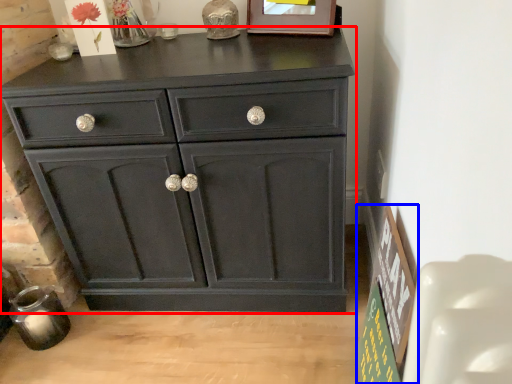
Question: Among these objects, which one is farthest to the camera, chest of drawers (highlighted by a red box) or bulletin board (highlighted by a blue box)?

Choices:
 (A) chest of drawers
 (B) bulletin board

Answer: (A)